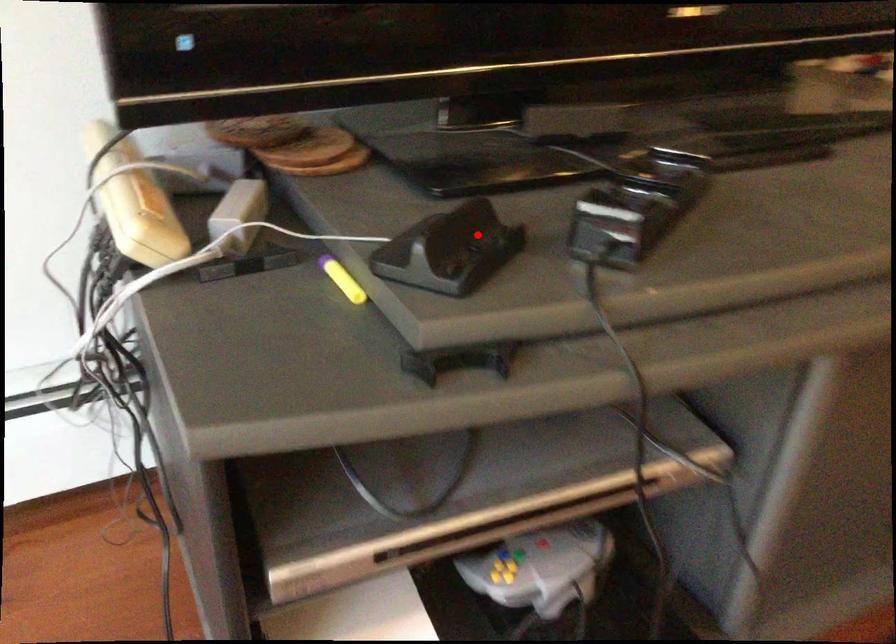
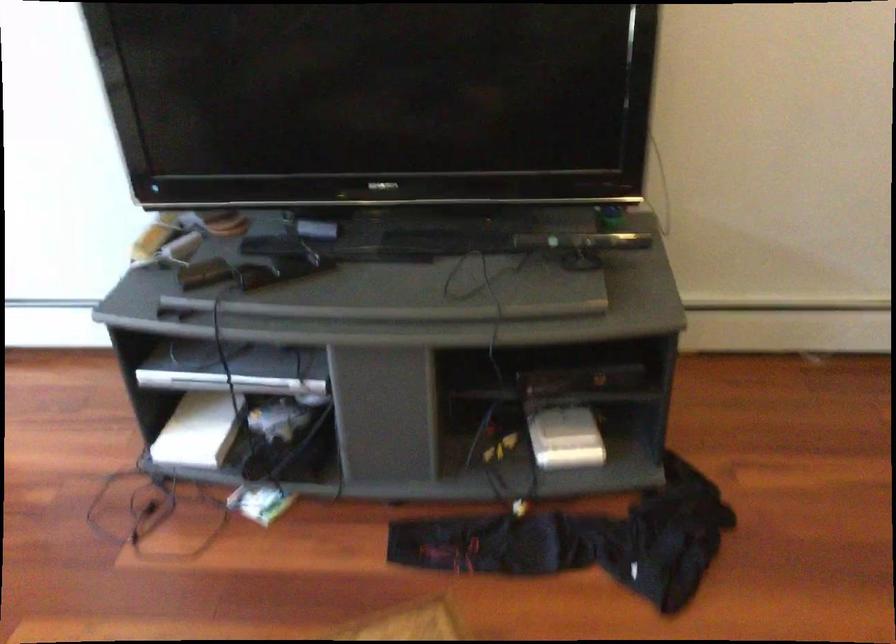
Question: I am providing you with two images of the same scene from different viewpoints. In image1, a red point is highlighted. Considering the same 3D point in image2, which of the following is correct?

Choices:
 (A) It is closer
 (B) It is farther

Answer: (B)